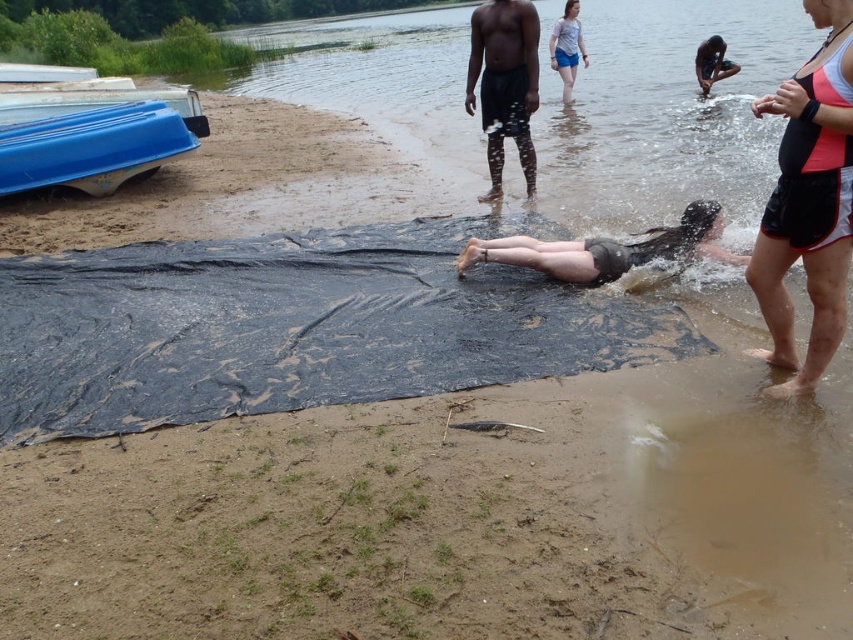
Question: Is transparent plastic tarp at lower center to the left of dark gray shorts at center from the viewer's perspective?

Choices:
 (A) no
 (B) yes

Answer: (A)

Question: Can you confirm if blue plastic boat at left is positioned to the right of dark skin human at upper right?

Choices:
 (A) yes
 (B) no

Answer: (B)

Question: Is transparent plastic tarp at lower center wider than dark gray shorts at center?

Choices:
 (A) yes
 (B) no

Answer: (A)

Question: Which point is farther from the camera taking this photo?

Choices:
 (A) (724, 45)
 (B) (814, 278)
 (C) (604, 32)

Answer: (C)

Question: Estimate the real-world distances between objects in this image. Which object is closer to the dark skin human at upper right?

Choices:
 (A) transparent plastic tarp at lower center
 (B) black matte shorts at lower right
 (C) light blue denim shorts at upper center
 (D) blue plastic boat at left

Answer: (C)

Question: Among these objects, which one is farthest from the camera?

Choices:
 (A) dark skin human at upper right
 (B) blue plastic boat at left
 (C) light blue denim shorts at upper center
 (D) dark gray shorts at center

Answer: (A)